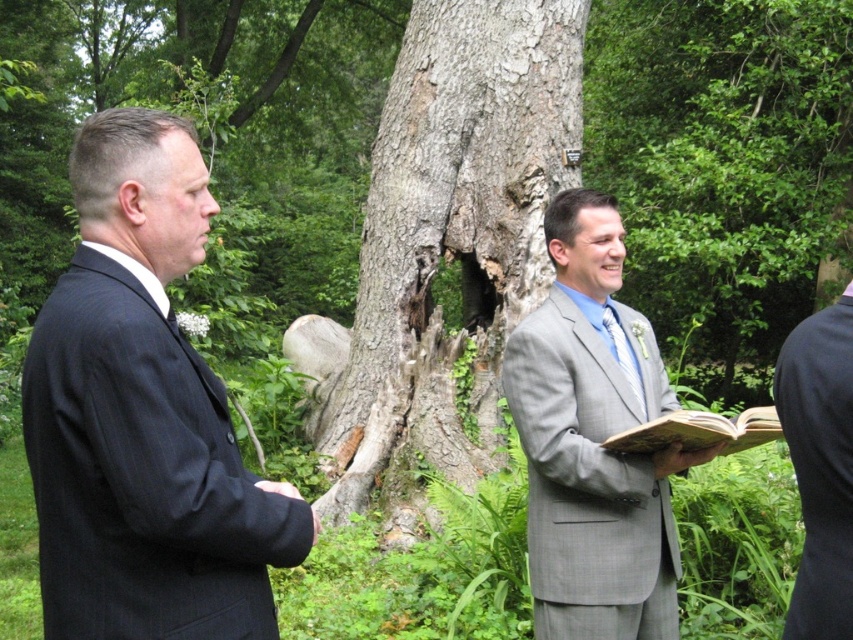
Question: Observing the image, what is the correct spatial positioning of gray rough bark tree trunk at center in reference to light blue satin tie at center?

Choices:
 (A) left
 (B) right

Answer: (A)

Question: Is black pinstripe suit at left to the left of gray rough bark tree trunk at center from the viewer's perspective?

Choices:
 (A) no
 (B) yes

Answer: (B)

Question: In this image, where is gray textured suit at center located relative to light blue satin tie at center?

Choices:
 (A) above
 (B) below

Answer: (B)

Question: Which object appears farthest from the camera in this image?

Choices:
 (A) light blue satin tie at center
 (B) gray textured suit at center

Answer: (A)

Question: Considering the real-world distances, which object is farthest from the light blue satin tie at center?

Choices:
 (A) rough bark tree at center
 (B) gray textured suit at center

Answer: (A)

Question: Considering the real-world distances, which object is closest to the rough bark tree at center?

Choices:
 (A) gray textured suit at center
 (B) gray rough bark tree trunk at center

Answer: (B)